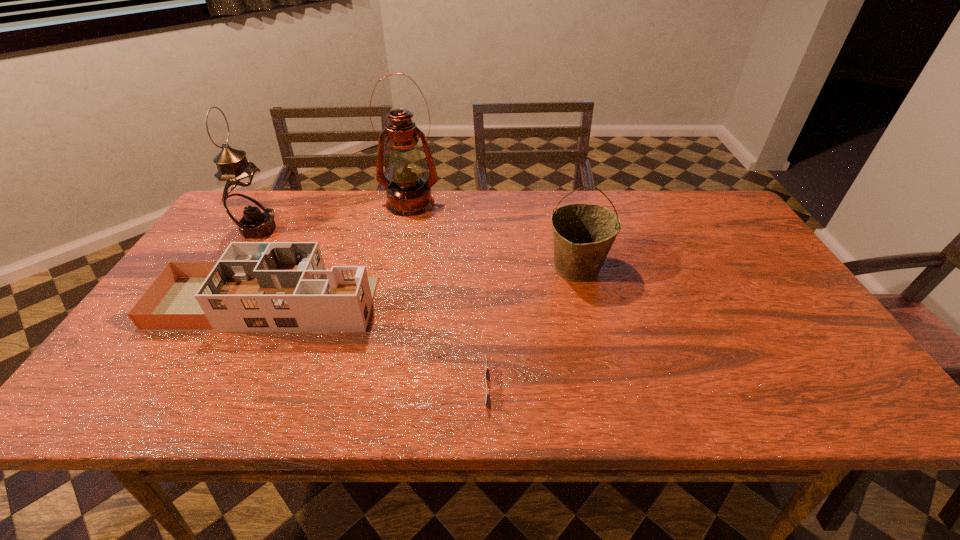
Find the location of a particular element. This screenshot has height=540, width=960. vacant space that satisfies the following two spatial constraints: 1. on the front side of the rightmost object; 2. on the front-facing side of the second object from right to left is located at coordinates (607, 387).

The image size is (960, 540). Find the location of `vacant space that satisfies the following two spatial constraints: 1. on the back side of the nearer oil lamp; 2. on the right side of the farther oil lamp`. vacant space that satisfies the following two spatial constraints: 1. on the back side of the nearer oil lamp; 2. on the right side of the farther oil lamp is located at coordinates (275, 203).

Where is `vacant area that satisfies the following two spatial constraints: 1. on the back side of the fourth nearest object; 2. on the right side of the farthest object`? The image size is (960, 540). vacant area that satisfies the following two spatial constraints: 1. on the back side of the fourth nearest object; 2. on the right side of the farthest object is located at coordinates (275, 203).